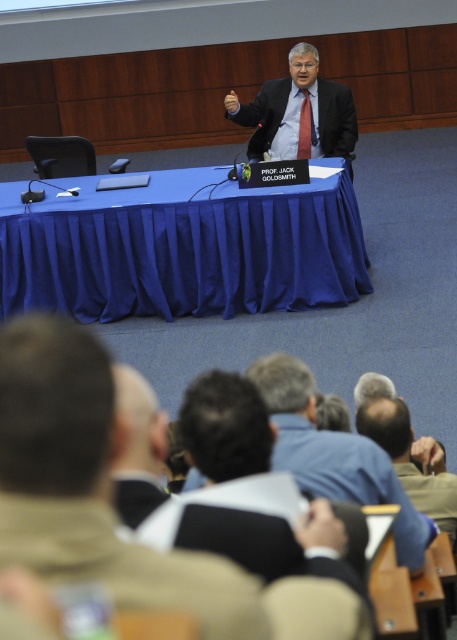
Does dark blue shirt at center appear on the right side of light brown leather jacket at lower right?

In fact, dark blue shirt at center is to the left of light brown leather jacket at lower right.

Measure the distance from dark blue shirt at center to light brown leather jacket at lower right.

The distance of dark blue shirt at center from light brown leather jacket at lower right is 28.27 inches.

What do you see at coordinates (333, 454) in the screenshot? This screenshot has width=457, height=640. I see `dark blue shirt at center` at bounding box center [333, 454].

You are a GUI agent. You are given a task and a screenshot of the screen. Output one action in this format:
    pyautogui.click(x=<x>, y=<y>)
    Task: Click on the dark blue shirt at center
    This screenshot has width=457, height=640.
    Given the screenshot: What is the action you would take?
    pyautogui.click(x=333, y=454)

Is dark blue shirt at center positioned behind matte black suit at center?

No, dark blue shirt at center is in front of matte black suit at center.

Who is positioned more to the right, dark blue shirt at center or matte black suit at center?

matte black suit at center

Describe the element at coordinates (333, 454) in the screenshot. I see `dark blue shirt at center` at that location.

Where is `dark blue shirt at center`? The image size is (457, 640). dark blue shirt at center is located at coordinates (333, 454).

Measure the distance between point (49, 548) and camera.

A distance of 1.12 meters exists between point (49, 548) and camera.

Does brown leather jacket at lower center lie in front of dark blue shirt at center?

Yes, it is.

Find the location of a particular element. Image resolution: width=457 pixels, height=640 pixels. brown leather jacket at lower center is located at coordinates pos(115,512).